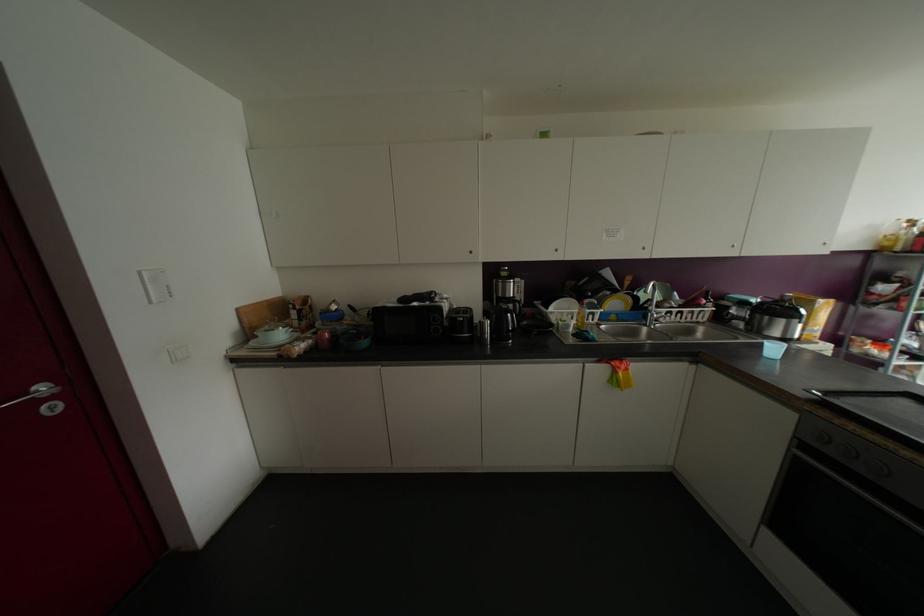
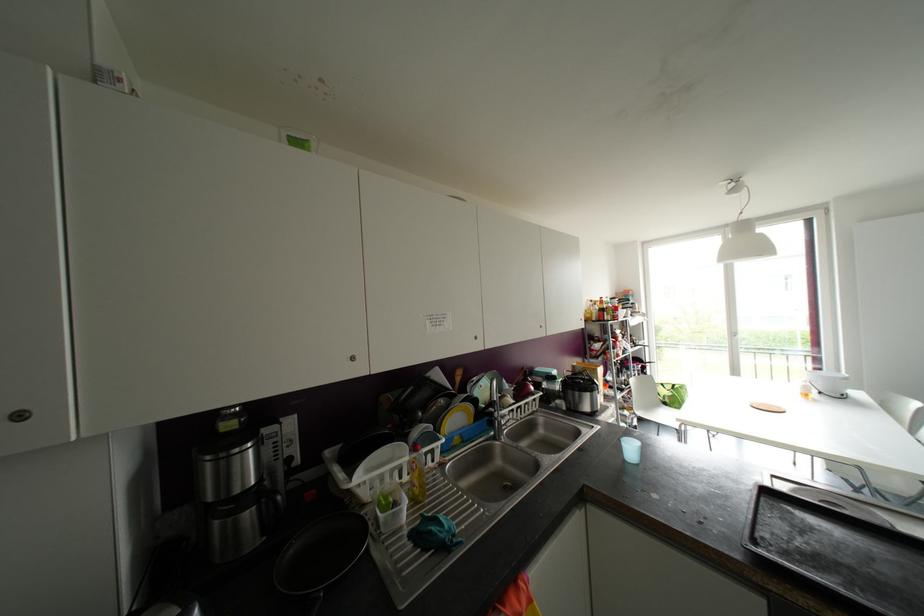
The point at (469,252) is marked in the first image. Where is the corresponding point in the second image?

(19, 416)